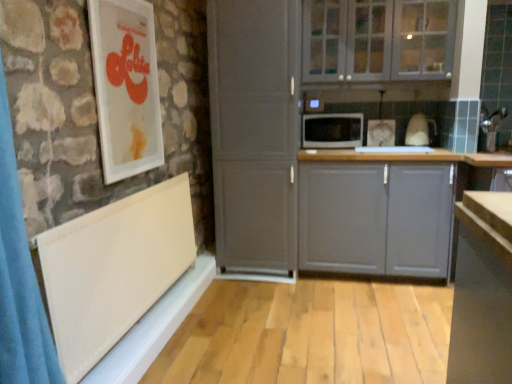
Question: From the image's perspective, is black matte microwave at center above or below white matte cabinet at center?

Choices:
 (A) below
 (B) above

Answer: (B)

Question: In terms of size, does black matte microwave at center appear bigger or smaller than white matte cabinet at center?

Choices:
 (A) big
 (B) small

Answer: (B)

Question: Based on their relative distances, which object is farther from the white textured radiator at lower left?

Choices:
 (A) black matte microwave at center
 (B) white glossy picture frame at upper left
 (C) white matte cabinet at center
 (D) white textured window sill at lower left
 (E) gray matte cabinet at center, arranged as the 1th cabinetry when ordered from the bottom

Answer: (A)

Question: Considering the real-world distances, which object is closest to the white glass cabinets at upper center, the second cabinetry positioned from the bottom?

Choices:
 (A) white glossy picture frame at upper left
 (B) black matte microwave at center
 (C) white matte cabinet at center
 (D) white textured window sill at lower left
 (E) gray matte cabinet at center, arranged as the 1th cabinetry when ordered from the bottom

Answer: (B)